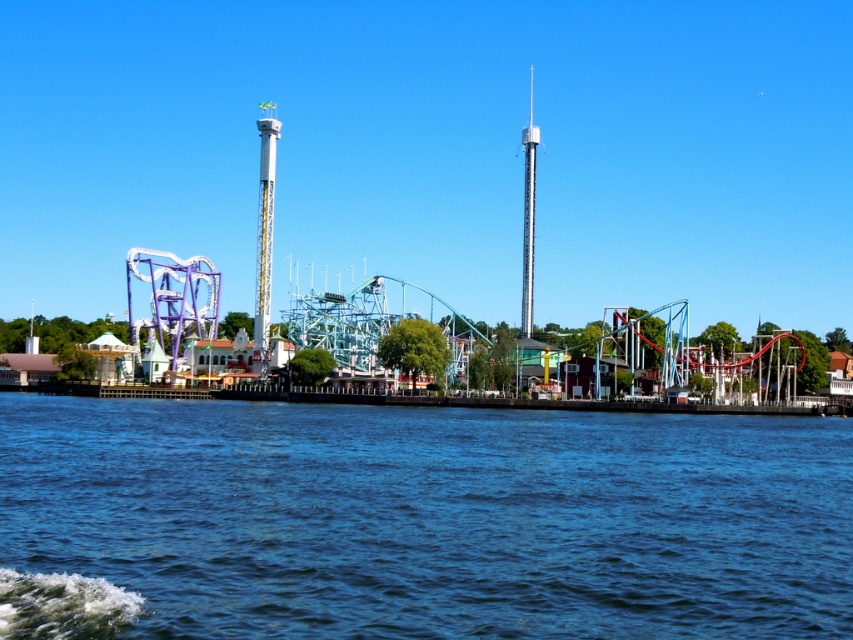
You are a park visitor standing at the entrance of the amusement park. You see the blue water at lower left and the metallic roller coaster at center. Which object is located to the right of the other?

The blue water at lower left is positioned on the right side of metallic roller coaster at center, so the blue water at lower left is to the right of the metallic roller coaster at center.

You are standing at the entrance of the amusement park and want to take a photo that includes both the blue water at lower left and the metallic silver tower at center. Which object should you position closer to the edge of the frame to ensure both are fully visible?

To ensure both the blue water at lower left and the metallic silver tower at center are fully visible in the photo, position the metallic silver tower at center closer to the edge of the frame since the blue water at lower left might be wider than the metallic silver tower at center.

You are standing at the entrance of the amusement park and see the blue water at lower left and the metallic silver tower at center. Which object is closer to the water surface?

The blue water at lower left is located below the metallic silver tower at center, so the blue water at lower left is closer to the water surface.